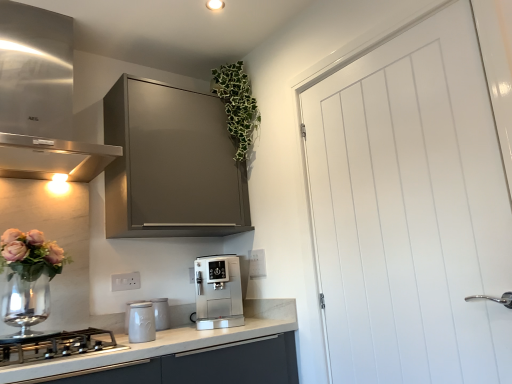
The height and width of the screenshot is (384, 512). Identify the location of white plastic electric outlet at lower center, which is the 2th electric outlet in right-to-left order. (125, 281).

Where is `green leafy plant at upper center`? green leafy plant at upper center is located at coordinates (237, 105).

What is the approximate width of green leafy plant at upper center?

green leafy plant at upper center is 13.08 inches wide.

The width and height of the screenshot is (512, 384). In order to click on matte gray cabinet at upper center in this screenshot , I will do `click(170, 164)`.

What do you see at coordinates (161, 313) in the screenshot? Image resolution: width=512 pixels, height=384 pixels. I see `white ceramic canister at center, which ranks as the second kitchen appliance in left-to-right order` at bounding box center [161, 313].

Find the location of `white plastic electric outlet at lower center, the first electric outlet from the left`. white plastic electric outlet at lower center, the first electric outlet from the left is located at coordinates (125, 281).

Which object is wider, white ceramic jar at lower left, positioned as the 2th kitchen appliance in right-to-left order, or stainless steel gas stove at lower left, the 1th kitchen appliance in the left-to-right sequence?

Wider between the two is stainless steel gas stove at lower left, the 1th kitchen appliance in the left-to-right sequence.

Locate an element on the screen. The height and width of the screenshot is (384, 512). kitchen appliance that is the 1st one when counting downward from the white ceramic jar at lower left, positioned as the 2th kitchen appliance in right-to-left order (from the image's perspective) is located at coordinates (55, 346).

From the image's perspective, is white ceramic jar at lower left, arranged as the third kitchen appliance when viewed from the left, beneath stainless steel gas stove at lower left, the 1th kitchen appliance in the left-to-right sequence?

Actually, white ceramic jar at lower left, arranged as the third kitchen appliance when viewed from the left, appears above stainless steel gas stove at lower left, the 1th kitchen appliance in the left-to-right sequence, in the image.

Is white ceramic jar at lower left, positioned as the 2th kitchen appliance in right-to-left order, far from stainless steel gas stove at lower left, acting as the 4th kitchen appliance starting from the right?

Actually, white ceramic jar at lower left, positioned as the 2th kitchen appliance in right-to-left order, and stainless steel gas stove at lower left, acting as the 4th kitchen appliance starting from the right, are a little close together.

Is green leafy plant at upper center inside the boundaries of stainless steel gas stove at lower left, the 1th kitchen appliance in the left-to-right sequence, or outside?

green leafy plant at upper center is located beyond the bounds of stainless steel gas stove at lower left, the 1th kitchen appliance in the left-to-right sequence.

In the image, is green leafy plant at upper center positioned in front of or behind stainless steel gas stove at lower left, the 1th kitchen appliance in the left-to-right sequence?

green leafy plant at upper center is behind stainless steel gas stove at lower left, the 1th kitchen appliance in the left-to-right sequence.

Is green leafy plant at upper center aimed at stainless steel gas stove at lower left, the 1th kitchen appliance in the left-to-right sequence?

No, green leafy plant at upper center is not turned towards stainless steel gas stove at lower left, the 1th kitchen appliance in the left-to-right sequence.

Is point (182, 99) more distant than point (113, 286)?

Yes.

Does matte gray cabinet at upper center have a greater height compared to white plastic electric outlet at lower center, the first electric outlet in the front-to-back sequence?

Correct, matte gray cabinet at upper center is much taller as white plastic electric outlet at lower center, the first electric outlet in the front-to-back sequence.

How different are the orientations of matte gray cabinet at upper center and white plastic electric outlet at lower center, the second electric outlet positioned from the back, in degrees?

1.36 degrees separate the facing orientations of matte gray cabinet at upper center and white plastic electric outlet at lower center, the second electric outlet positioned from the back.

Which is in front, matte gray cabinet at upper center or white plastic electric outlet at lower center, the first electric outlet in the front-to-back sequence?

matte gray cabinet at upper center is closer to the camera.

From a real-world perspective, is matte gray cabinet at upper center positioned under satin silver coffee machine at center, placed as the fourth kitchen appliance when sorted from left to right, based on gravity?

No, from a real-world perspective, matte gray cabinet at upper center is not below satin silver coffee machine at center, placed as the fourth kitchen appliance when sorted from left to right.

This screenshot has width=512, height=384. Identify the location of the 1st kitchen appliance below the matte gray cabinet at upper center (from the image's perspective). (218, 292).

Is matte gray cabinet at upper center oriented towards satin silver coffee machine at center, placed as the fourth kitchen appliance when sorted from left to right?

No, matte gray cabinet at upper center is not aimed at satin silver coffee machine at center, placed as the fourth kitchen appliance when sorted from left to right.

Considering the positions of points (178, 229) and (234, 274), is point (178, 229) farther from camera compared to point (234, 274)?

No.

The image size is (512, 384). Identify the location of the 2nd kitchen appliance counting from the right side of the white ceramic canister at center, arranged as the 3th kitchen appliance when viewed from the right. (218, 292).

Looking at the image, does white ceramic canister at center, arranged as the 3th kitchen appliance when viewed from the right, seem bigger or smaller compared to satin silver coffee machine at center, placed as the 1th kitchen appliance when sorted from right to left?

In the image, white ceramic canister at center, arranged as the 3th kitchen appliance when viewed from the right, appears to be smaller than satin silver coffee machine at center, placed as the 1th kitchen appliance when sorted from right to left.

Considering the relative positions of white ceramic canister at center, arranged as the 3th kitchen appliance when viewed from the right, and satin silver coffee machine at center, placed as the fourth kitchen appliance when sorted from left to right, in the image provided, is white ceramic canister at center, arranged as the 3th kitchen appliance when viewed from the right, to the left or to the right of satin silver coffee machine at center, placed as the fourth kitchen appliance when sorted from left to right,?

white ceramic canister at center, arranged as the 3th kitchen appliance when viewed from the right, is positioned on satin silver coffee machine at center, placed as the fourth kitchen appliance when sorted from left to right,'s left side.

From a real-world perspective, is white ceramic canister at center, arranged as the 3th kitchen appliance when viewed from the right, physically above matte gray cabinet at upper center?

Incorrect, from a real-world perspective, white ceramic canister at center, arranged as the 3th kitchen appliance when viewed from the right, is lower than matte gray cabinet at upper center.

Where is `the 2nd kitchen appliance counting from the left side of the matte gray cabinet at upper center`? the 2nd kitchen appliance counting from the left side of the matte gray cabinet at upper center is located at coordinates (161, 313).

Can we say white ceramic canister at center, arranged as the 3th kitchen appliance when viewed from the right, lies outside matte gray cabinet at upper center?

Yes, white ceramic canister at center, arranged as the 3th kitchen appliance when viewed from the right, is outside of matte gray cabinet at upper center.

Who is taller, white ceramic canister at center, arranged as the 3th kitchen appliance when viewed from the right, or matte gray cabinet at upper center?

Standing taller between the two is matte gray cabinet at upper center.

The width and height of the screenshot is (512, 384). I want to click on home appliance on the left side of green leafy plant at upper center, so click(x=41, y=99).

Is stainless steel range hood at upper left in front of or behind green leafy plant at upper center in the image?

Visually, stainless steel range hood at upper left is located in front of green leafy plant at upper center.

Which is more to the right, stainless steel range hood at upper left or green leafy plant at upper center?

Positioned to the right is green leafy plant at upper center.

Is stainless steel range hood at upper left facing towards green leafy plant at upper center?

No, stainless steel range hood at upper left is not aimed at green leafy plant at upper center.

At what (x,y) coordinates should I click in order to perform the action: click on kitchen appliance in front of the white ceramic jar at lower left, positioned as the 2th kitchen appliance in right-to-left order. Please return your answer as a coordinate pair (x, y). Looking at the image, I should click on (55, 346).

At what (x,y) coordinates should I click in order to perform the action: click on floral arrangement behind the stainless steel gas stove at lower left, acting as the 4th kitchen appliance starting from the right. Please return your answer as a coordinate pair (x, y). This screenshot has width=512, height=384. Looking at the image, I should click on (237, 105).

Estimate the real-world distances between objects in this image. Which object is closer to white plastic electric outlet at lower center, which is the 2th electric outlet in right-to-left order, stainless steel range hood at upper left or white plastic electric outlet at center, which ranks as the 1th electric outlet in back-to-front order?

Based on the image, white plastic electric outlet at center, which ranks as the 1th electric outlet in back-to-front order, appears to be nearer to white plastic electric outlet at lower center, which is the 2th electric outlet in right-to-left order.

Looking at the image, which one is located further to white smooth door at right, green leafy plant at upper center or white plastic electric outlet at lower center, the second electric outlet positioned from the back?

Based on the image, white plastic electric outlet at lower center, the second electric outlet positioned from the back, appears to be further to white smooth door at right.

When comparing their distances from stainless steel range hood at upper left, does white ceramic canister at center, which ranks as the second kitchen appliance in left-to-right order, or stainless steel gas stove at lower left, the 1th kitchen appliance in the left-to-right sequence, seem further?

white ceramic canister at center, which ranks as the second kitchen appliance in left-to-right order, is further to stainless steel range hood at upper left.

From the image, which object appears to be nearer to green leafy plant at upper center, satin silver coffee machine at center, placed as the fourth kitchen appliance when sorted from left to right, or white ceramic canister at center, arranged as the 3th kitchen appliance when viewed from the right?

Based on the image, satin silver coffee machine at center, placed as the fourth kitchen appliance when sorted from left to right, appears to be nearer to green leafy plant at upper center.

Estimate the real-world distances between objects in this image. Which object is closer to white ceramic canister at center, which ranks as the second kitchen appliance in left-to-right order, white plastic electric outlet at lower center, the second electric outlet positioned from the back, or stainless steel range hood at upper left?

Among the two, white plastic electric outlet at lower center, the second electric outlet positioned from the back, is located nearer to white ceramic canister at center, which ranks as the second kitchen appliance in left-to-right order.

When comparing their distances from white ceramic canister at center, arranged as the 3th kitchen appliance when viewed from the right, does stainless steel gas stove at lower left, acting as the 4th kitchen appliance starting from the right, or green leafy plant at upper center seem closer?

stainless steel gas stove at lower left, acting as the 4th kitchen appliance starting from the right.

Based on their spatial positions, is stainless steel gas stove at lower left, acting as the 4th kitchen appliance starting from the right, or white plastic electric outlet at lower center, the second electric outlet positioned from the back, closer to green leafy plant at upper center?

white plastic electric outlet at lower center, the second electric outlet positioned from the back, lies closer to green leafy plant at upper center than the other object.

Based on their spatial positions, is white ceramic jar at lower left, positioned as the 2th kitchen appliance in right-to-left order, or white ceramic canister at center, arranged as the 3th kitchen appliance when viewed from the right, closer to white smooth door at right?

Based on the image, white ceramic jar at lower left, positioned as the 2th kitchen appliance in right-to-left order, appears to be nearer to white smooth door at right.

The height and width of the screenshot is (384, 512). I want to click on floral arrangement situated between white plastic electric outlet at lower center, which is the 2th electric outlet in right-to-left order, and white smooth door at right from left to right, so click(237, 105).

In order to click on kitchen appliance between stainless steel gas stove at lower left, the 1th kitchen appliance in the left-to-right sequence, and satin silver coffee machine at center, placed as the 1th kitchen appliance when sorted from right to left, along the z-axis in this screenshot , I will do `click(141, 322)`.

Find the location of `cabinetry between stainless steel range hood at upper left and satin silver coffee machine at center, placed as the fourth kitchen appliance when sorted from left to right, from top to bottom`. cabinetry between stainless steel range hood at upper left and satin silver coffee machine at center, placed as the fourth kitchen appliance when sorted from left to right, from top to bottom is located at coordinates (170, 164).

Where is `cabinetry between stainless steel range hood at upper left and white smooth door at right from left to right`? The image size is (512, 384). cabinetry between stainless steel range hood at upper left and white smooth door at right from left to right is located at coordinates (170, 164).